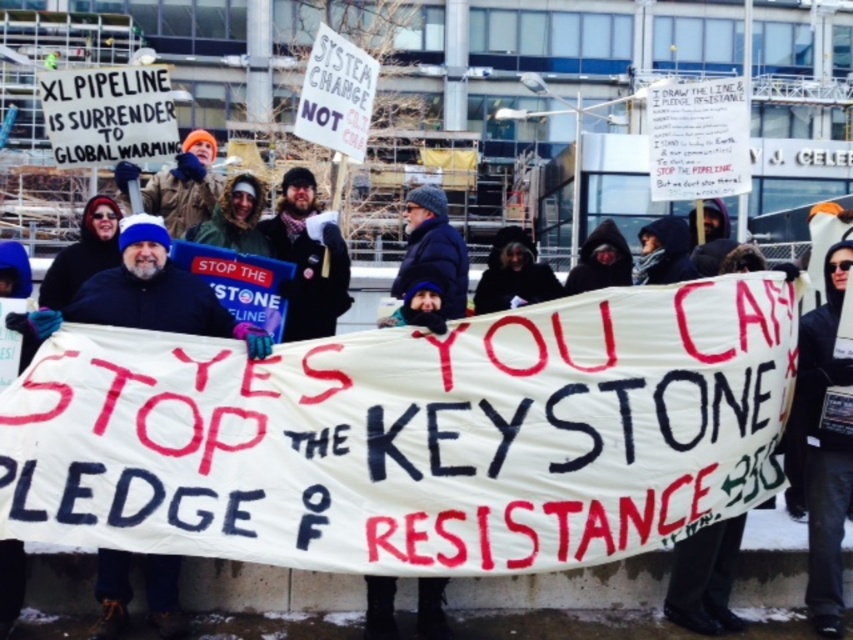
Is the position of white fabric banner at center less distant than that of bearded man with scarf at center?

That is True.

Does white fabric banner at center have a greater width compared to bearded man with scarf at center?

Correct, the width of white fabric banner at center exceeds that of bearded man with scarf at center.

Is point (125, 612) positioned before point (323, 291)?

Yes, it is.

Where is `white fabric banner at center`? white fabric banner at center is located at coordinates (151, 292).

Who is more forward, [817,308] or [306,305]?

Positioned in front is point [817,308].

Between black hooded sweatshirt at center and bearded man with scarf at center, which one appears on the right side from the viewer's perspective?

black hooded sweatshirt at center is more to the right.

Which is behind, point (839, 368) or point (271, 252)?

The point (271, 252) is behind.

Locate an element on the screen. black hooded sweatshirt at center is located at coordinates (824, 444).

From the picture: Between white fabric banner at center and black hooded sweatshirt at center, which one appears on the left side from the viewer's perspective?

white fabric banner at center is more to the left.

Between point (169, 584) and point (809, 554), which one is positioned behind?

Positioned behind is point (809, 554).

Between point (126, 250) and point (793, 403), which one is positioned behind?

The point (793, 403) is behind.

Identify the location of white fabric banner at center. (151, 292).